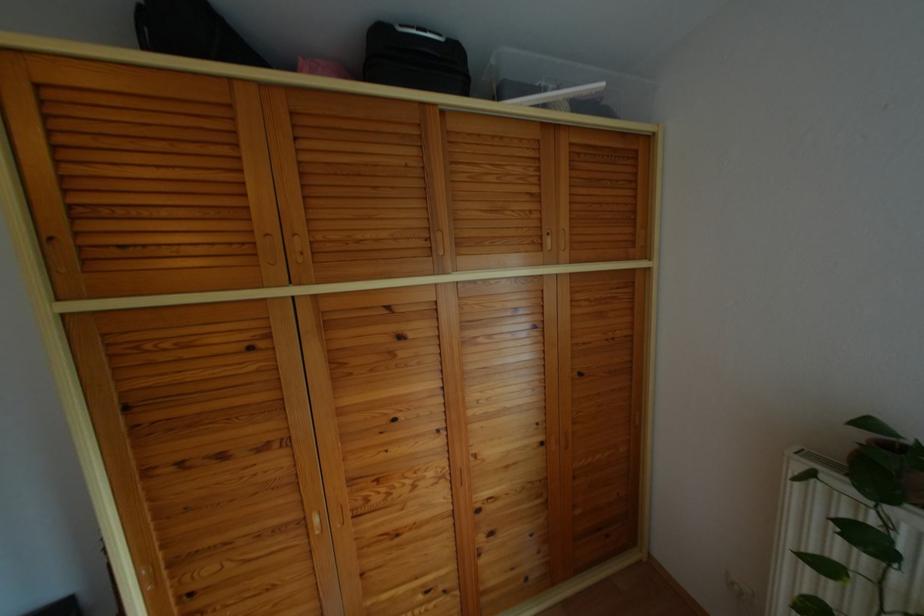
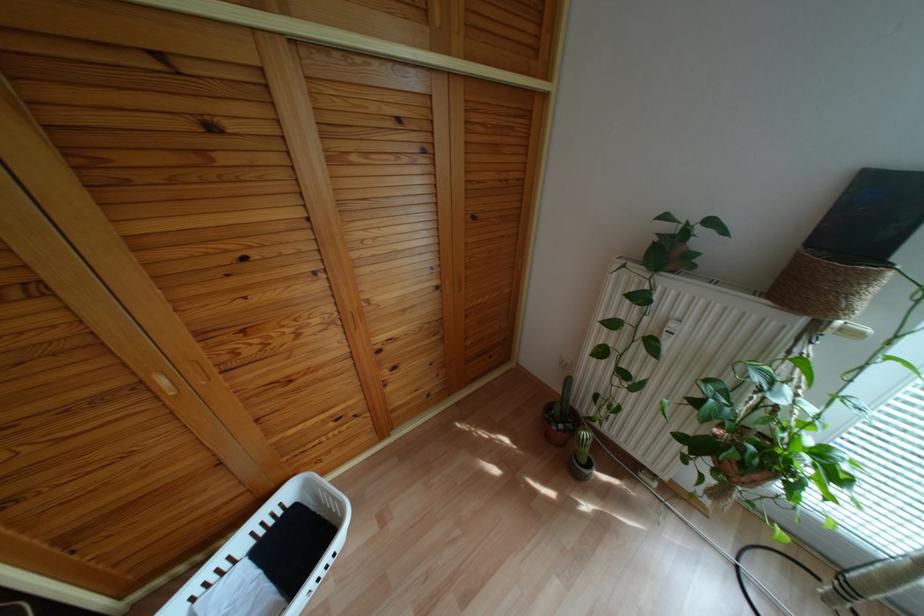
Based on the continuous images, in which direction is the camera rotating?

The camera's rotation is toward right-down.